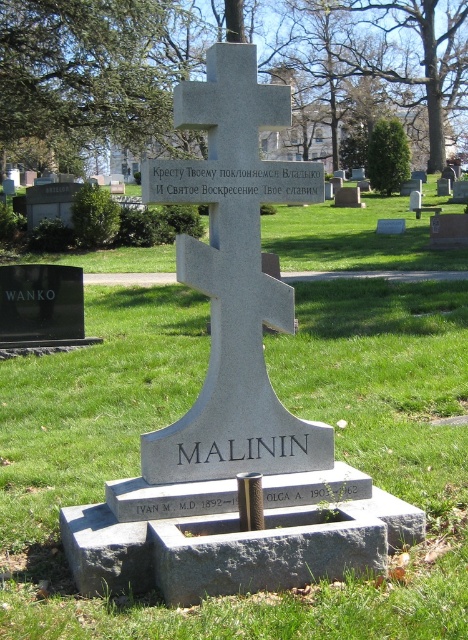
You are a gardener tasked with mowing the lawn in the cemetery. You notice the green grass at center and the gray stone cross at center. Which object is wider?

The green grass at center is wider than the gray stone cross at center according to the description.

Consider the image. You are standing in the cemetery looking at the gray stone cross at center. There is also green grass at center. Which object is closer to you?

The green grass at center is closer to the viewer than the gray stone cross at center.